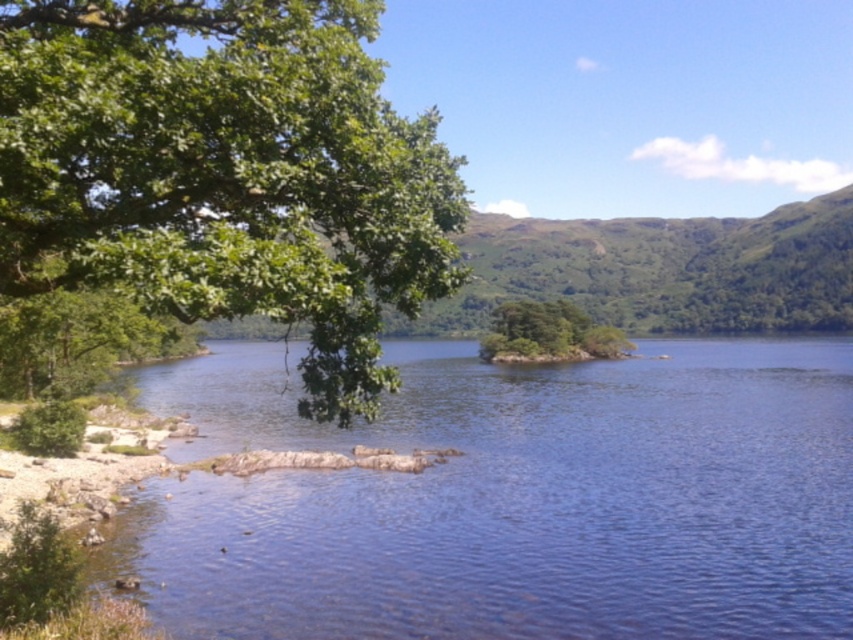
Question: Does clear water at lower left appear under green leafy island at center?

Choices:
 (A) no
 (B) yes

Answer: (B)

Question: Does green leafy tree at upper left have a smaller size compared to green leafy island at center?

Choices:
 (A) yes
 (B) no

Answer: (A)

Question: Which of the following is the closest to the observer?

Choices:
 (A) (167, 387)
 (B) (410, 182)

Answer: (B)

Question: Which point appears closest to the camera in this image?

Choices:
 (A) (520, 349)
 (B) (221, 38)

Answer: (B)

Question: Which is nearer to the green leafy tree at upper left?

Choices:
 (A) clear water at lower left
 (B) green leafy island at center

Answer: (A)

Question: Where is green leafy tree at upper left located in relation to green leafy island at center in the image?

Choices:
 (A) above
 (B) below

Answer: (A)